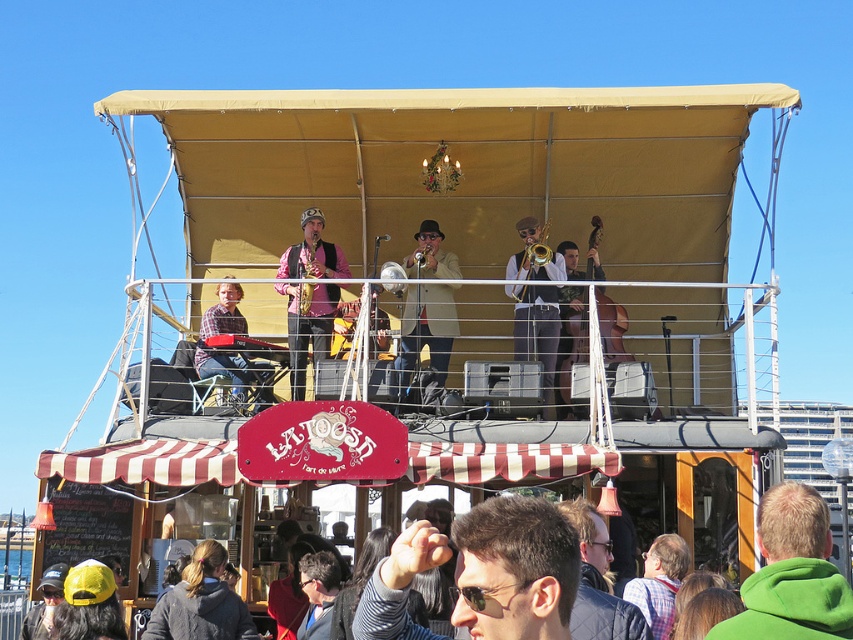
You are a photographer positioned at the front of the stage. You want to take a photo that includes both the green fleece jacket at lower right and the gold brass trumpet at upper center. Which object should you adjust your camera angle to focus on first to ensure both are in frame?

You should focus on the gold brass trumpet at upper center first because the green fleece jacket at lower right is to the right of it, so adjusting from the trumpet towards the jacket ensures both are captured.

You are a photographer standing at the back of the stage. You want to take a photo that includes both the sunglasses at center and the shiny gold saxophone at center. Given that your camera can focus on objects within a 20 meter range, will both items be in focus?

The sunglasses at center and shiny gold saxophone at center are 24.29 meters apart. Since the camera can only focus within 20 meters, the distance between them exceeds the camera range. Therefore, both items cannot be in focus simultaneously.

You are a photographer trying to capture a clear shot of both the sunglasses at center and the shiny gold saxophone at center. Since you want the saxophone to be the main focus, should you position it to the left or right of the sunglasses in your photo?

The sunglasses at center is positioned on the right side of shiny gold saxophone at center, so to have the saxophone as the main focus, you should position it to the left of the sunglasses in your photo.